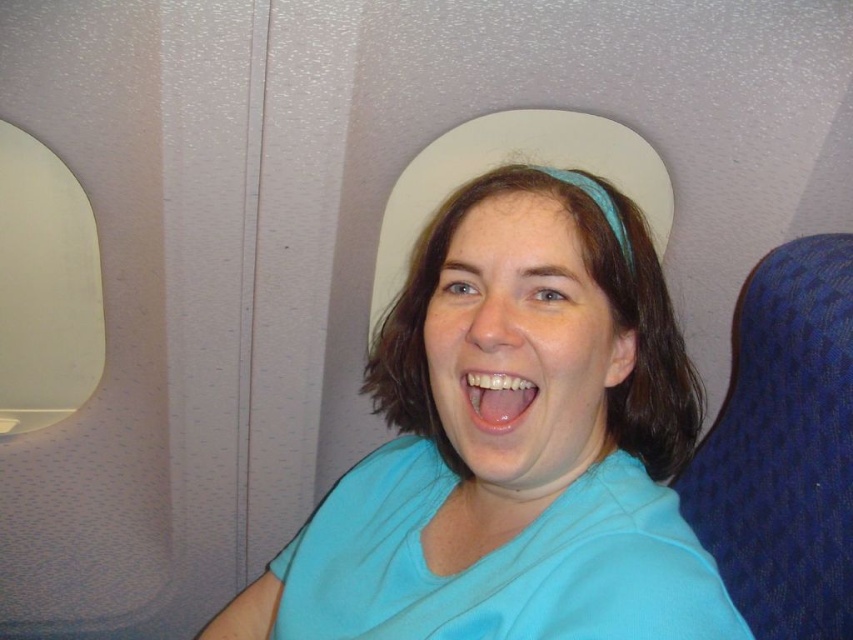
Question: Is light blue fabric at center positioned in front of matte white teeth at center?

Choices:
 (A) yes
 (B) no

Answer: (A)

Question: Among these points, which one is nearest to the camera?

Choices:
 (A) (546, 193)
 (B) (518, 416)

Answer: (B)

Question: Is light blue fabric at center smaller than matte white teeth at center?

Choices:
 (A) yes
 (B) no

Answer: (B)

Question: Considering the relative positions of light blue fabric at center and matte white teeth at center in the image provided, where is light blue fabric at center located with respect to matte white teeth at center?

Choices:
 (A) left
 (B) right

Answer: (B)